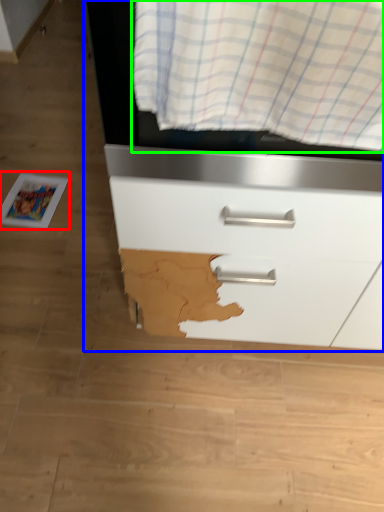
Question: Which object is the closest to the magazine (highlighted by a red box)? Choose among these: chest of drawers (highlighted by a blue box) or curtain (highlighted by a green box).

Choices:
 (A) chest of drawers
 (B) curtain

Answer: (A)